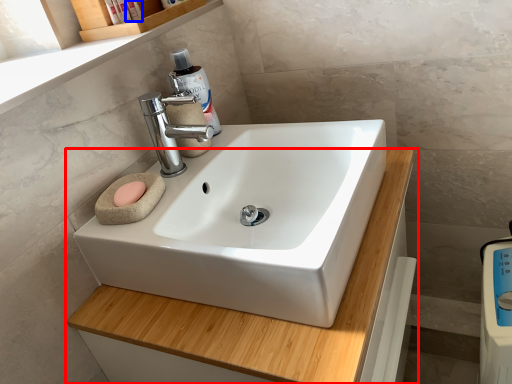
Question: Among these objects, which one is farthest to the camera, bathroom cabinet (highlighted by a red box) or toiletry (highlighted by a blue box)?

Choices:
 (A) bathroom cabinet
 (B) toiletry

Answer: (B)